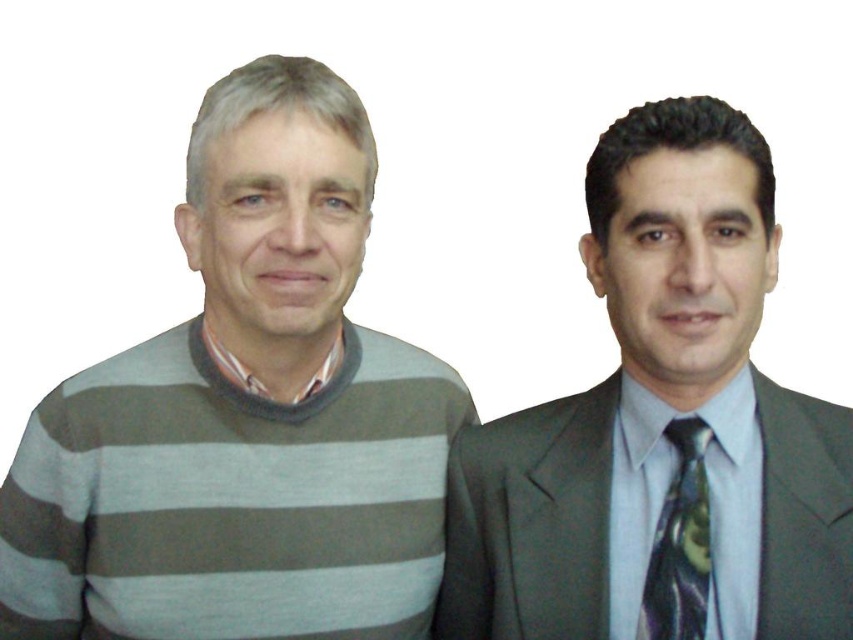
Can you confirm if gray striped sweater at left is wider than matte gray suit at right?

Indeed, gray striped sweater at left has a greater width compared to matte gray suit at right.

Is gray striped sweater at left behind matte gray suit at right?

Yes, it is.

Which is behind, point (339, 272) or point (714, 564)?

The point (339, 272) is more distant.

Image resolution: width=853 pixels, height=640 pixels. I want to click on gray striped sweater at left, so click(245, 413).

Is matte gray suit at right bigger than shiny dark green tie at right?

Yes, matte gray suit at right is bigger than shiny dark green tie at right.

Does matte gray suit at right appear on the left side of shiny dark green tie at right?

Correct, you'll find matte gray suit at right to the left of shiny dark green tie at right.

Who is more distant from viewer, (x=664, y=316) or (x=682, y=435)?

Positioned behind is point (x=682, y=435).

This screenshot has width=853, height=640. What are the coordinates of `matte gray suit at right` in the screenshot? It's located at (660, 428).

Is gray striped sweater at left wider than shiny dark green tie at right?

Indeed, gray striped sweater at left has a greater width compared to shiny dark green tie at right.

Who is taller, gray striped sweater at left or shiny dark green tie at right?

gray striped sweater at left is taller.

Which is in front, point (210, 218) or point (708, 515)?

Positioned in front is point (708, 515).

Find the location of `gray striped sweater at left`. gray striped sweater at left is located at coordinates (245, 413).